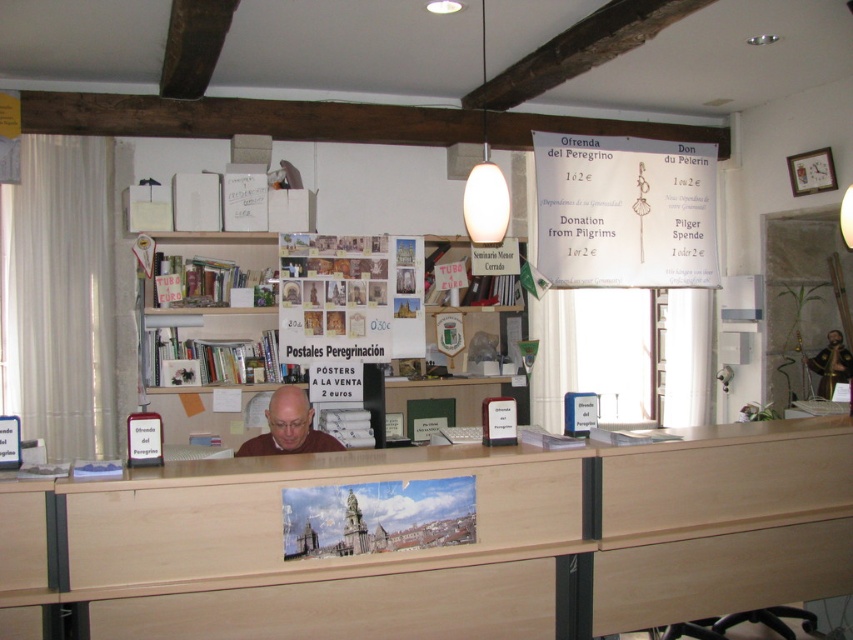
You are a visitor at the reception desk and need to place a 15 cm tall object. The white paper at upper center and the wooden drawer at lower left are both available. Which one can accommodate the object based on their height?

The white paper at upper center has a greater height compared to the wooden drawer at lower left, so it can accommodate the 15 cm tall object.

You are a visitor at the reception desk and need to place a new sign that is the same size as the white paper at upper center. Is there enough space on the wooden drawer at lower left to place this new sign?

The white paper at upper center is bigger than the wooden drawer at lower left, so the new sign cannot fit on the wooden drawer at lower left.

You are a pilgrim at the reception desk and need to place a large envelope. The light wood drawer at lower right and the wooden drawer at lower left are both available. Which drawer has enough space to accommodate the envelope?

The light wood drawer at lower right has a greater width than the wooden drawer at lower left, so it can accommodate the large envelope.